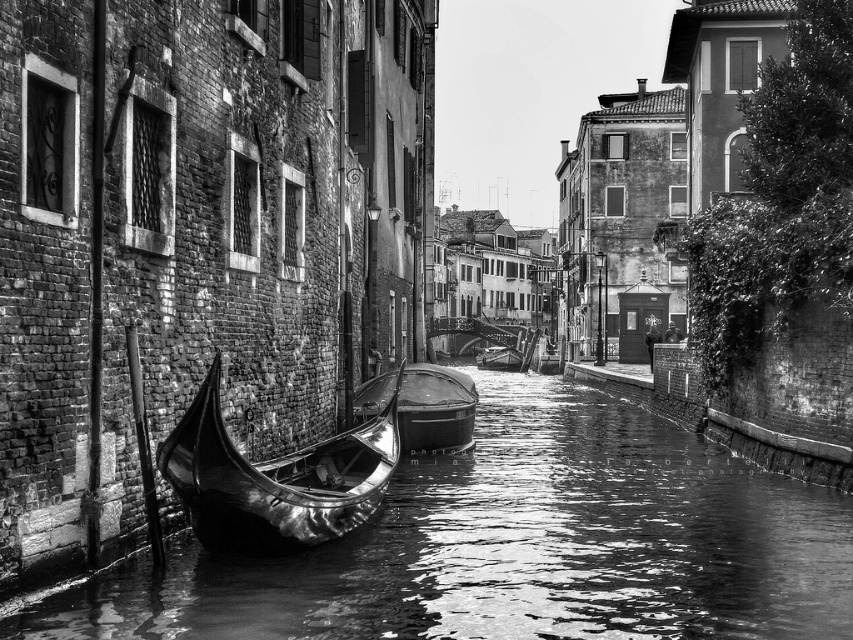
You are navigating a small boat through the canal and need to dock near the shiny polished wood canoe at left. Based on its coordinates, is the canoe positioned closer to the left or right side of the canal?

The shiny polished wood canoe at left is located at point (x=276, y=477), which indicates it is positioned closer to the left side of the canal.

In the scene shown: You are standing on the canal bank and need to board a boat. You see a shiny polished wood canoe at left and a shiny black gondola at center. Which boat is closer to you?

The shiny polished wood canoe at left is closer to you since it is only 8.18 meters away from the shiny black gondola at center, meaning it is nearer than the gondola.

You are standing on a bridge overlooking the canal. You want to drop a small paper boat into the glossy wood canal at center. Considering the distance, will the paper boat reach the canal without getting damaged?

The glossy wood canal at center is 27.62 meters from the viewer. Since the paper boat is light and the distance is not extremely far, it should reach the canal safely without damage.